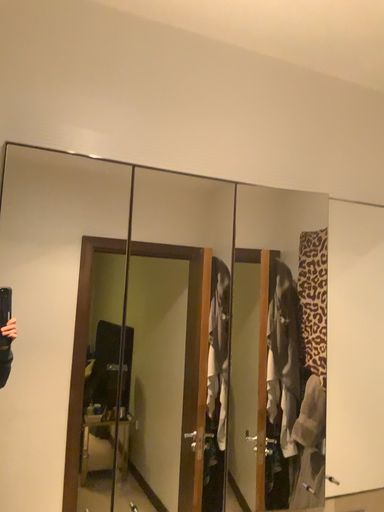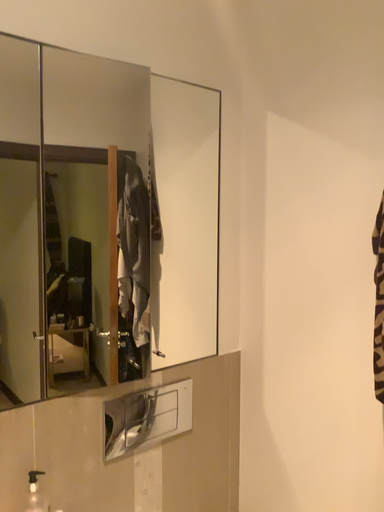
Question: How did the camera likely rotate when shooting the video?

Choices:
 (A) rotated right
 (B) rotated left

Answer: (A)